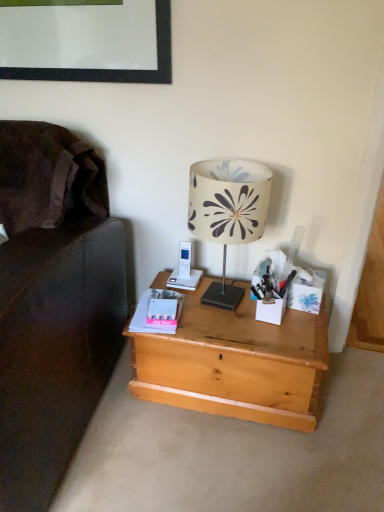
You are a GUI agent. You are given a task and a screenshot of the screen. Output one action in this format:
    pyautogui.click(x=<x>, y=<y>)
    Task: Click on the space that is in front of white matte stationery at right
    The height and width of the screenshot is (512, 384).
    Given the screenshot: What is the action you would take?
    pyautogui.click(x=284, y=338)